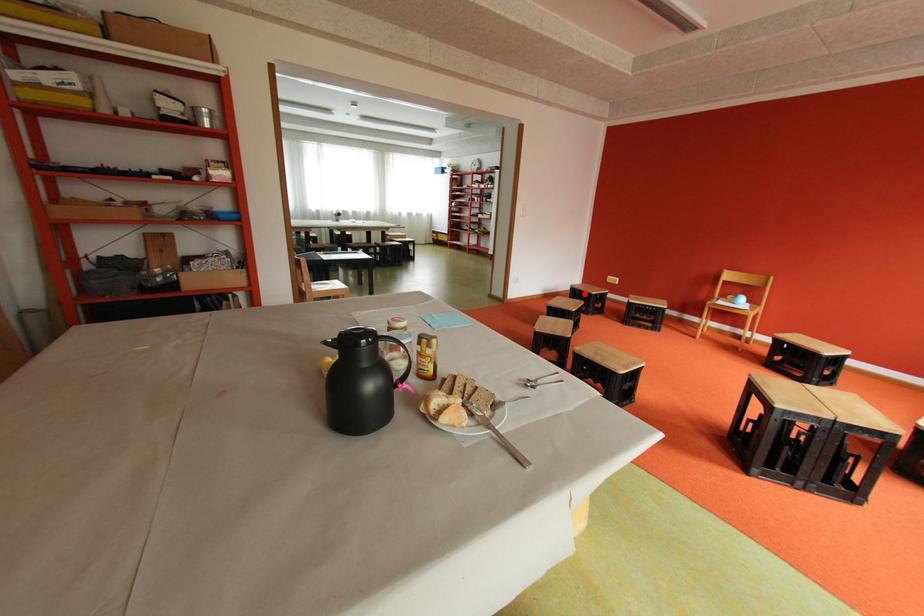
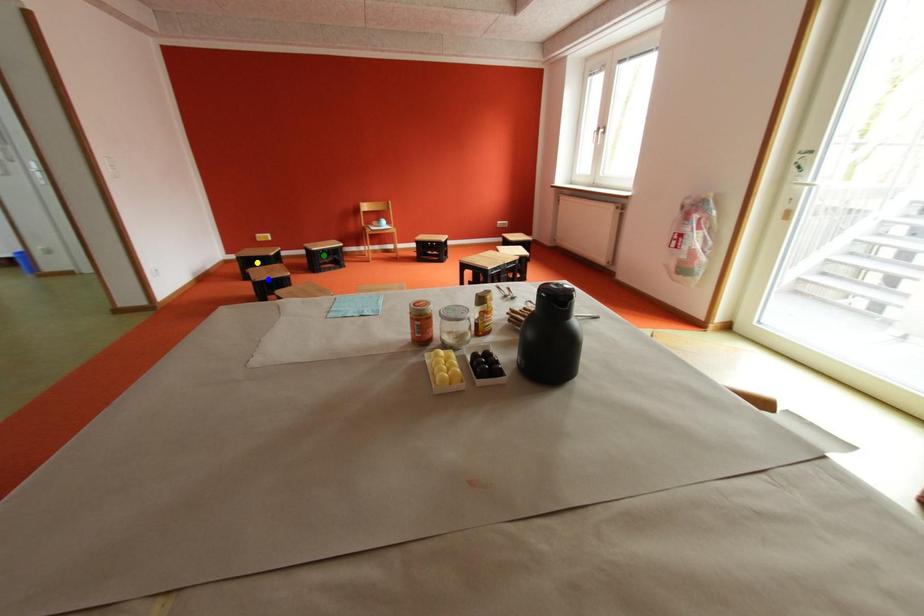
Question: I am providing you with two images of the same scene from different viewpoints. A red point is marked on the first image. You are given multiple points on the second image. In image 2, which mark is for the same physical point as the one in image 1?

Choices:
 (A) yellow point
 (B) green point
 (C) blue point

Answer: (A)